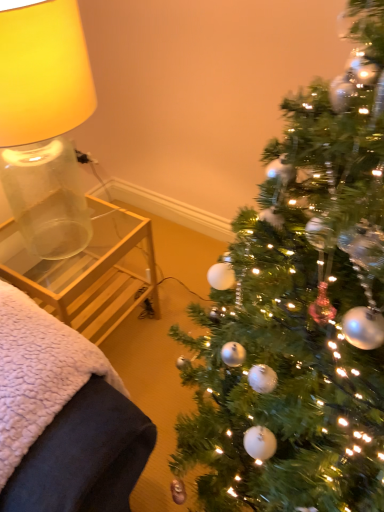
Question: Can you confirm if translucent glass lampshade at left is smaller than clear glass side table at left?

Choices:
 (A) no
 (B) yes

Answer: (A)

Question: Is translucent glass lampshade at left aimed at clear glass side table at left?

Choices:
 (A) no
 (B) yes

Answer: (A)

Question: From the image's perspective, is translucent glass lampshade at left beneath clear glass side table at left?

Choices:
 (A) yes
 (B) no

Answer: (B)

Question: Would you say translucent glass lampshade at left is a long distance from clear glass side table at left?

Choices:
 (A) yes
 (B) no

Answer: (B)

Question: Is clear glass side table at left a part of translucent glass lampshade at left?

Choices:
 (A) no
 (B) yes

Answer: (A)

Question: Based on their positions, is clear glass table at left located to the left or right of translucent glass lampshade at left?

Choices:
 (A) left
 (B) right

Answer: (B)

Question: From their relative heights in the image, would you say clear glass table at left is taller or shorter than translucent glass lampshade at left?

Choices:
 (A) short
 (B) tall

Answer: (A)

Question: Looking at their shapes, would you say clear glass table at left is wider or thinner than translucent glass lampshade at left?

Choices:
 (A) wide
 (B) thin

Answer: (A)

Question: Would you say clear glass table at left is inside or outside translucent glass lampshade at left?

Choices:
 (A) outside
 (B) inside

Answer: (A)

Question: From the image's perspective, is clear glass side table at left positioned above or below translucent glass lampshade at left?

Choices:
 (A) above
 (B) below

Answer: (B)

Question: In the image, is clear glass side table at left positioned in front of or behind translucent glass lampshade at left?

Choices:
 (A) behind
 (B) front

Answer: (B)

Question: In terms of width, does clear glass side table at left look wider or thinner when compared to translucent glass lampshade at left?

Choices:
 (A) thin
 (B) wide

Answer: (B)

Question: Considering the relative positions of clear glass side table at left and translucent glass lampshade at left in the image provided, is clear glass side table at left to the left or to the right of translucent glass lampshade at left?

Choices:
 (A) right
 (B) left

Answer: (A)

Question: Considering their positions, is clear glass table at left located in front of or behind green textured christmas tree at right?

Choices:
 (A) front
 (B) behind

Answer: (B)

Question: From their relative heights in the image, would you say clear glass table at left is taller or shorter than green textured christmas tree at right?

Choices:
 (A) short
 (B) tall

Answer: (A)